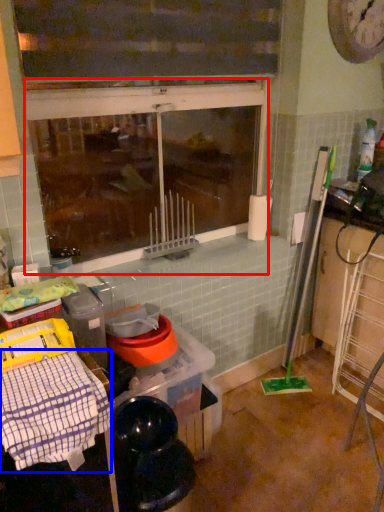
Question: Which point is closer to the camera, window (highlighted by a red box) or blanket (highlighted by a blue box)?

Choices:
 (A) window
 (B) blanket

Answer: (B)